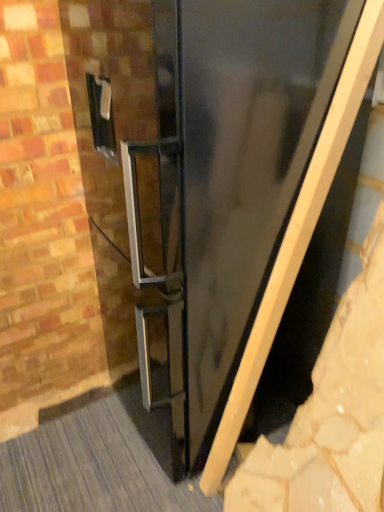
Identify the location of glossy black door at center. Image resolution: width=384 pixels, height=512 pixels. (228, 180).

This screenshot has width=384, height=512. What do you see at coordinates (228, 180) in the screenshot?
I see `glossy black door at center` at bounding box center [228, 180].

Where is `glossy black door at center`? This screenshot has width=384, height=512. glossy black door at center is located at coordinates (228, 180).